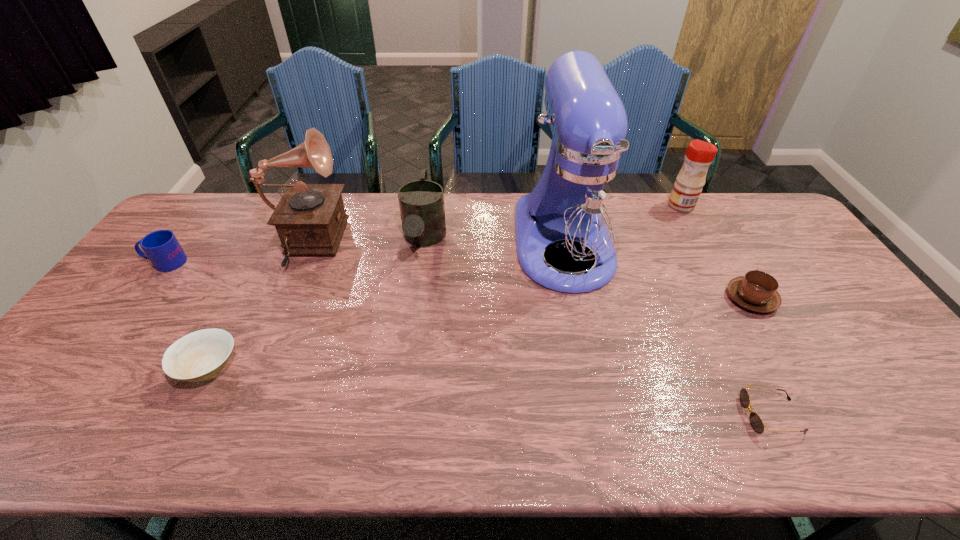
Where is `free point between the tallest object and the sunglasses`? This screenshot has width=960, height=540. free point between the tallest object and the sunglasses is located at coordinates (667, 329).

The image size is (960, 540). I want to click on object that is the third nearest to the mug, so click(x=421, y=202).

Select which object appears as the seventh closest to the third tallest object. Please provide its 2D coordinates. Your answer should be formatted as a tuple, i.e. [(x, y)], where the tuple contains the x and y coordinates of a point satisfying the conditions above.

[(161, 247)]

The height and width of the screenshot is (540, 960). What are the coordinates of `free space that satisfies the following two spatial constraints: 1. at the mixing area of the fifth object from left to right; 2. on the side with the handle of the mug` in the screenshot? It's located at (567, 262).

At what (x,y) coordinates should I click in order to perform the action: click on vacant region that satisfies the following two spatial constraints: 1. on the side with the handle of the fifth tallest object; 2. on the right side of the bowl. Please return your answer as a coordinate pair (x, y). The height and width of the screenshot is (540, 960). Looking at the image, I should click on (85, 367).

Where is `free space that satisfies the following two spatial constraints: 1. on the side with the handle of the leftmost object; 2. on the side of the cappuccino with the handle`? The height and width of the screenshot is (540, 960). free space that satisfies the following two spatial constraints: 1. on the side with the handle of the leftmost object; 2. on the side of the cappuccino with the handle is located at coordinates (138, 299).

The width and height of the screenshot is (960, 540). I want to click on free space in the image that satisfies the following two spatial constraints: 1. on the side of the cappuccino with the handle; 2. on the horn of the record player, so click(x=720, y=247).

Where is `vacant space that satisfies the following two spatial constraints: 1. with the spout on the fourth tallest object; 2. on the horn of the seventh shortest object`? vacant space that satisfies the following two spatial constraints: 1. with the spout on the fourth tallest object; 2. on the horn of the seventh shortest object is located at coordinates (422, 247).

The image size is (960, 540). Identify the location of free location that satisfies the following two spatial constraints: 1. on the side with the handle of the bowl; 2. on the right side of the fourth shortest object. (85, 367).

Where is `free spot that satisfies the following two spatial constraints: 1. on the side with the handle of the bowl; 2. on the left side of the mug`? The width and height of the screenshot is (960, 540). free spot that satisfies the following two spatial constraints: 1. on the side with the handle of the bowl; 2. on the left side of the mug is located at coordinates (85, 367).